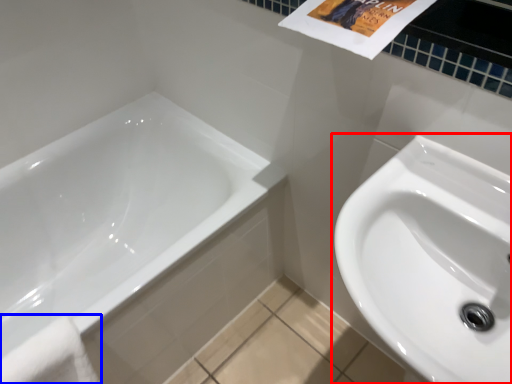
Question: Which object is further to the camera taking this photo, sink (highlighted by a red box) or bath towel (highlighted by a blue box)?

Choices:
 (A) sink
 (B) bath towel

Answer: (B)